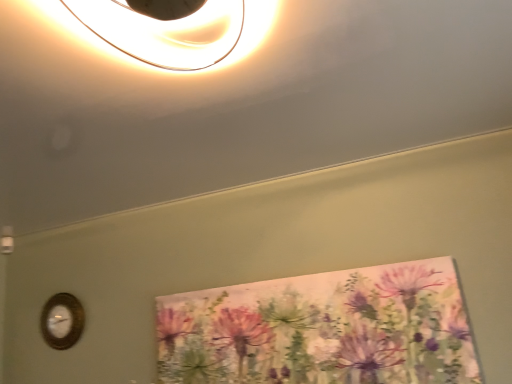
Question: Considering the positions of watercolor floral painting at center and wooden wall clock at lower left in the image, is watercolor floral painting at center taller or shorter than wooden wall clock at lower left?

Choices:
 (A) tall
 (B) short

Answer: (A)

Question: Based on their positions, is watercolor floral painting at center located to the left or right of wooden wall clock at lower left?

Choices:
 (A) left
 (B) right

Answer: (B)

Question: Is watercolor floral painting at center wider or thinner than wooden wall clock at lower left?

Choices:
 (A) thin
 (B) wide

Answer: (B)

Question: Considering the positions of wooden wall clock at lower left and watercolor floral painting at center in the image, is wooden wall clock at lower left taller or shorter than watercolor floral painting at center?

Choices:
 (A) short
 (B) tall

Answer: (A)

Question: Visually, is wooden wall clock at lower left positioned to the left or to the right of watercolor floral painting at center?

Choices:
 (A) left
 (B) right

Answer: (A)

Question: Based on their sizes in the image, would you say wooden wall clock at lower left is bigger or smaller than watercolor floral painting at center?

Choices:
 (A) big
 (B) small

Answer: (B)

Question: In terms of width, does wooden wall clock at lower left look wider or thinner when compared to watercolor floral painting at center?

Choices:
 (A) thin
 (B) wide

Answer: (A)